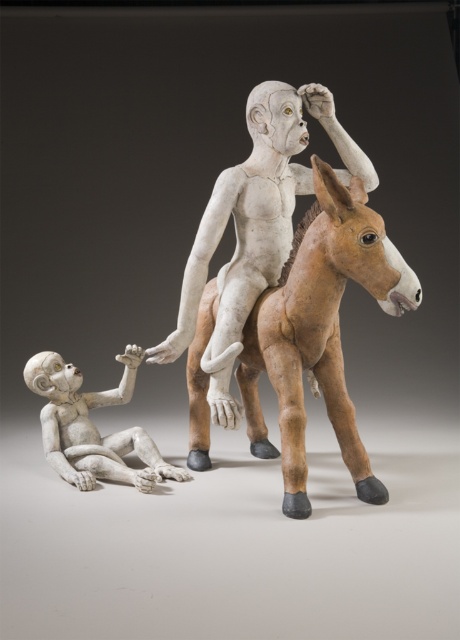
Question: Among these objects, which one is farthest from the camera?

Choices:
 (A) brown matte horse at center
 (B) white matte figure at center

Answer: (B)

Question: Where is brown matte horse at center located in relation to white matte figure at center in the image?

Choices:
 (A) left
 (B) right

Answer: (B)

Question: Among these points, which one is nearest to the camera?

Choices:
 (A) (70, 420)
 (B) (254, 396)

Answer: (A)

Question: Estimate the real-world distances between objects in this image. Which object is farther from the brown matte horse at center?

Choices:
 (A) matte white figure at lower left
 (B) white matte figure at center

Answer: (A)

Question: Does brown matte horse at center appear on the left side of matte white figure at lower left?

Choices:
 (A) yes
 (B) no

Answer: (B)

Question: Is brown matte horse at center below matte white figure at lower left?

Choices:
 (A) no
 (B) yes

Answer: (A)